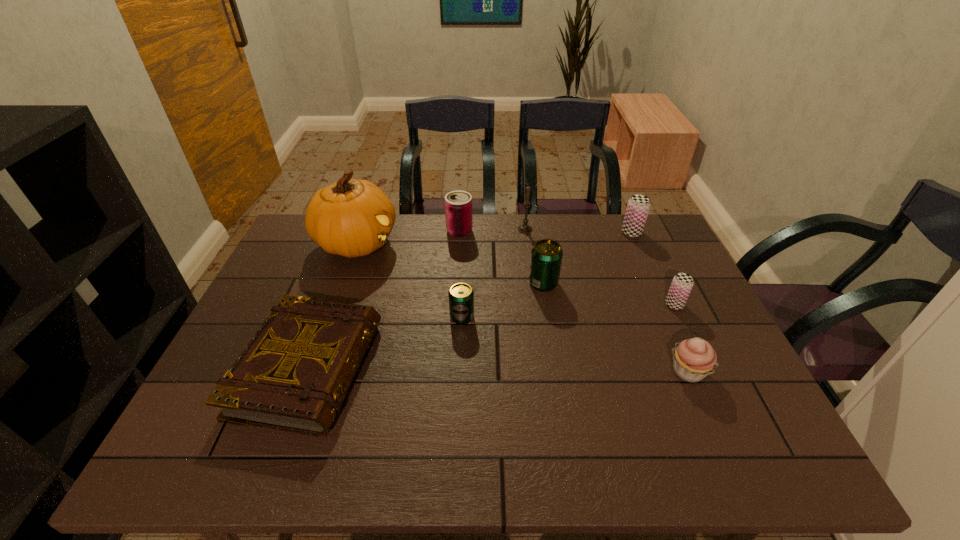
The height and width of the screenshot is (540, 960). What are the coordinates of `the left green beer can` in the screenshot? It's located at (461, 296).

I want to click on the leftmost beer can, so click(x=461, y=296).

You are a GUI agent. You are given a task and a screenshot of the screen. Output one action in this format:
    pyautogui.click(x=<x>, y=<y>)
    Task: Click on the shortest object
    This screenshot has width=960, height=540.
    Given the screenshot: What is the action you would take?
    pyautogui.click(x=294, y=374)

The height and width of the screenshot is (540, 960). In order to click on hardback book in this screenshot , I will do tap(294, 374).

The height and width of the screenshot is (540, 960). Identify the location of vacant space located 0.050m on the front face of the pumpkin. pos(414,244).

The height and width of the screenshot is (540, 960). Find the location of `free space located on the left of the candle`. free space located on the left of the candle is located at coordinates (442, 229).

Where is `vacant space located on the left of the can`? vacant space located on the left of the can is located at coordinates (420, 231).

The image size is (960, 540). What are the coordinates of `vacant space located on the left of the bigger purple beer can` in the screenshot? It's located at (588, 233).

Locate an element on the screen. free space located on the front of the second farthest beer can is located at coordinates (558, 373).

Locate an element on the screen. The width and height of the screenshot is (960, 540). free space located 0.360m on the back of the pink cupcake is located at coordinates (641, 264).